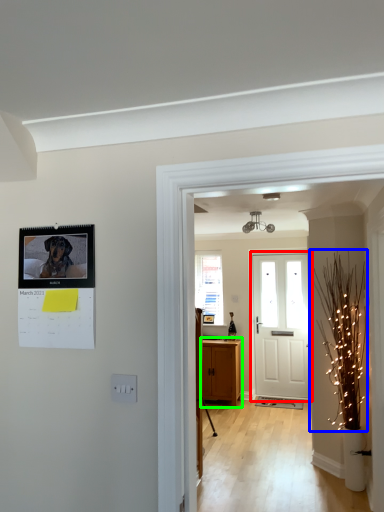
Question: Based on their relative distances, which object is nearer to door (highlighted by a red box)? Choose from christmas light (highlighted by a blue box) and cabinetry (highlighted by a green box).

Choices:
 (A) christmas light
 (B) cabinetry

Answer: (B)